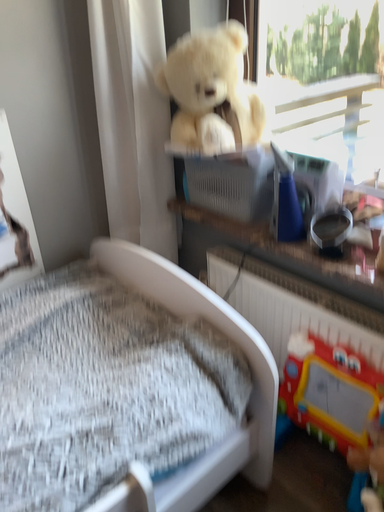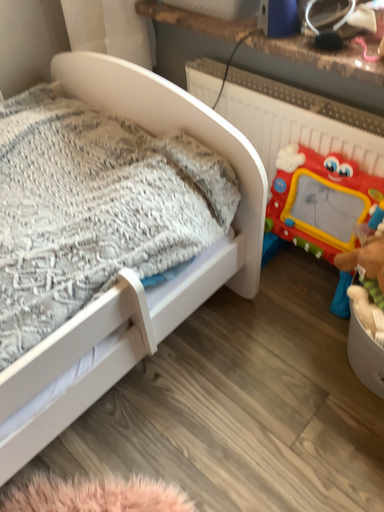
Question: Which way did the camera rotate in the video?

Choices:
 (A) rotated downward
 (B) rotated upward

Answer: (A)